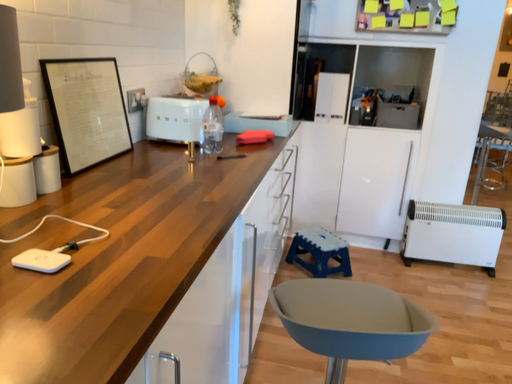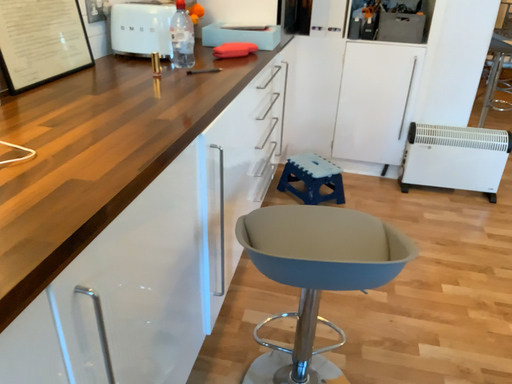
Question: Which way did the camera rotate in the video?

Choices:
 (A) rotated downward
 (B) rotated upward

Answer: (A)